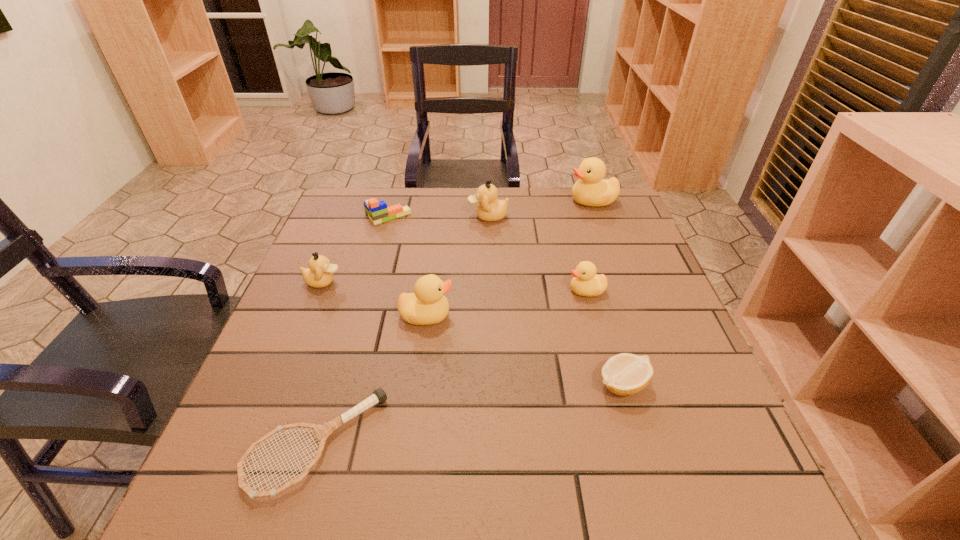
You are a GUI agent. You are given a task and a screenshot of the screen. Output one action in this format:
    pyautogui.click(x=<x>, y=<y>)
    Task: Click on the empty location between the left tan duckling and the farthest yellow duckling
    Image resolution: width=960 pixels, height=540 pixels.
    Given the screenshot: What is the action you would take?
    pyautogui.click(x=458, y=241)

This screenshot has height=540, width=960. I want to click on vacant area that lies between the nearer tan duckling and the lemon, so click(x=472, y=333).

Identify which object is the third closest to the second nearest yellow duckling. Please provide its 2D coordinates. Your answer should be formatted as a tuple, i.e. [(x, y)], where the tuple contains the x and y coordinates of a point satisfying the conditions above.

[(489, 209)]

This screenshot has height=540, width=960. Identify the location of object that is the fourth closest to the biggest yellow duckling. (427, 305).

Point out which duckling is positioned as the third nearest to the second nearest yellow duckling. Please provide its 2D coordinates. Your answer should be formatted as a tuple, i.e. [(x, y)], where the tuple contains the x and y coordinates of a point satisfying the conditions above.

[(591, 190)]

This screenshot has width=960, height=540. I want to click on duckling that stands as the third closest to the farthest yellow duckling, so click(427, 305).

Image resolution: width=960 pixels, height=540 pixels. In order to click on yellow duckling object that ranks as the second closest to the smallest yellow duckling in this screenshot , I will do `click(591, 190)`.

At what (x,y) coordinates should I click in order to perform the action: click on yellow duckling that is the third closest to the left tan duckling. Please return your answer as a coordinate pair (x, y). The image size is (960, 540). Looking at the image, I should click on (591, 190).

The width and height of the screenshot is (960, 540). What are the coordinates of `free space that satisfies the following two spatial constraints: 1. on the face of the lemon; 2. on the left side of the leftmost duckling` in the screenshot? It's located at click(x=282, y=384).

Where is `vacant region that satisfies the following two spatial constraints: 1. on the face of the smallest yellow duckling; 2. on the right side of the yellow lemon`? This screenshot has height=540, width=960. vacant region that satisfies the following two spatial constraints: 1. on the face of the smallest yellow duckling; 2. on the right side of the yellow lemon is located at coordinates (612, 384).